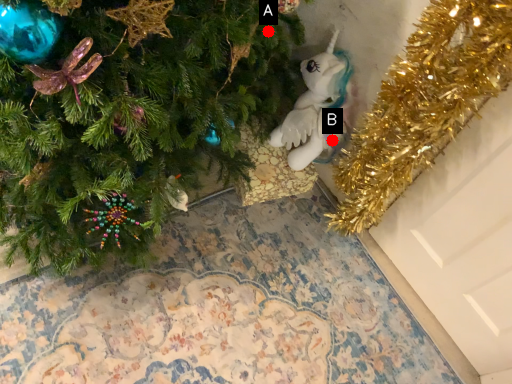
Question: Two points are circled on the image, labeled by A and B beside each circle. Which point appears farthest from the camera in this image?

Choices:
 (A) A is further
 (B) B is further

Answer: (B)